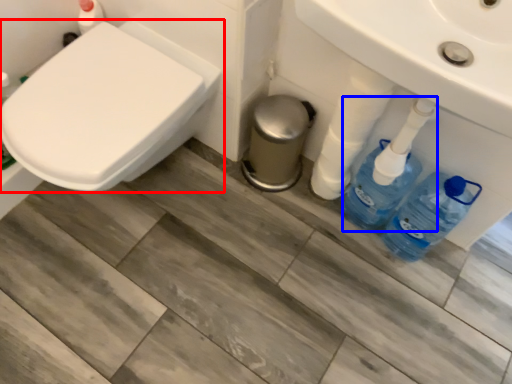
Question: Which point is closer to the camera, toilet (highlighted by a red box) or cleaning product (highlighted by a blue box)?

Choices:
 (A) toilet
 (B) cleaning product

Answer: (A)